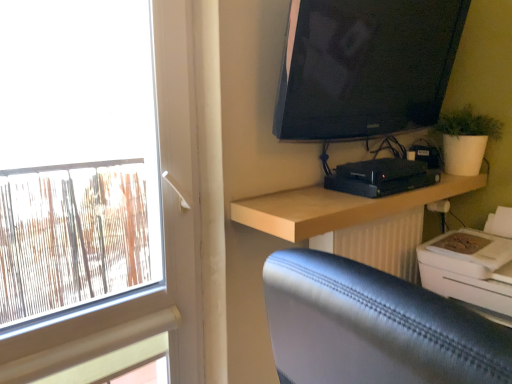
Question: Relative to white plastic printer at lower right, is light wood shelf at upper right in front or behind?

Choices:
 (A) front
 (B) behind

Answer: (A)

Question: Is light wood shelf at upper right inside the boundaries of white plastic printer at lower right, or outside?

Choices:
 (A) inside
 (B) outside

Answer: (B)

Question: Based on their relative distances, which object is farther from the white plastic printer at lower right?

Choices:
 (A) white matte window at left
 (B) light wood shelf at upper right
 (C) black plastic device at center
 (D) black glossy tv at upper right

Answer: (A)

Question: Which is farther from the white matte window at left?

Choices:
 (A) black glossy tv at upper right
 (B) light wood shelf at upper right
 (C) black plastic device at center
 (D) white plastic printer at lower right

Answer: (D)